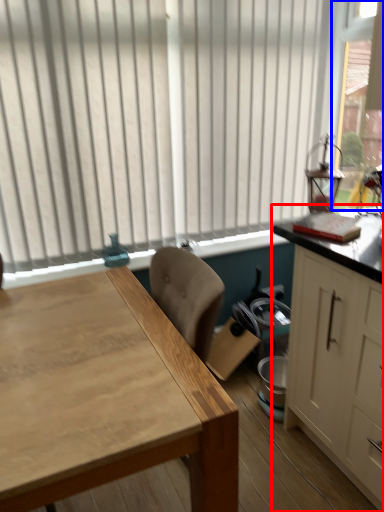
Question: Which object is further to the camera taking this photo, cabinetry (highlighted by a red box) or window screen (highlighted by a blue box)?

Choices:
 (A) cabinetry
 (B) window screen

Answer: (B)